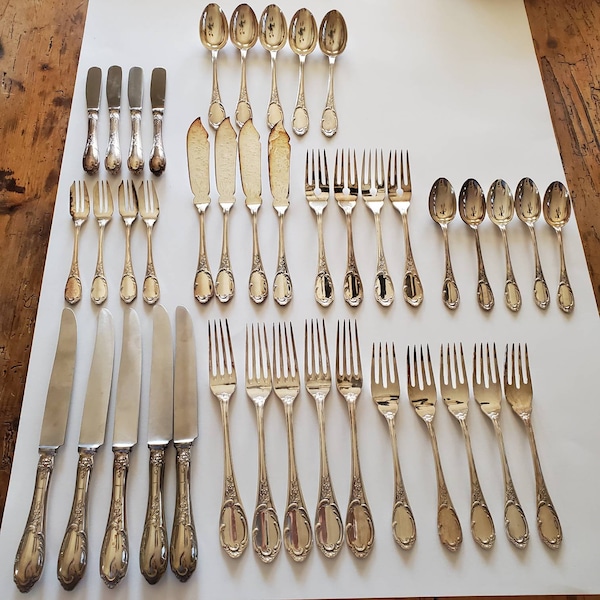
What are the coordinates of `table` in the screenshot? It's located at (27, 115), (583, 50), (567, 103), (17, 208).